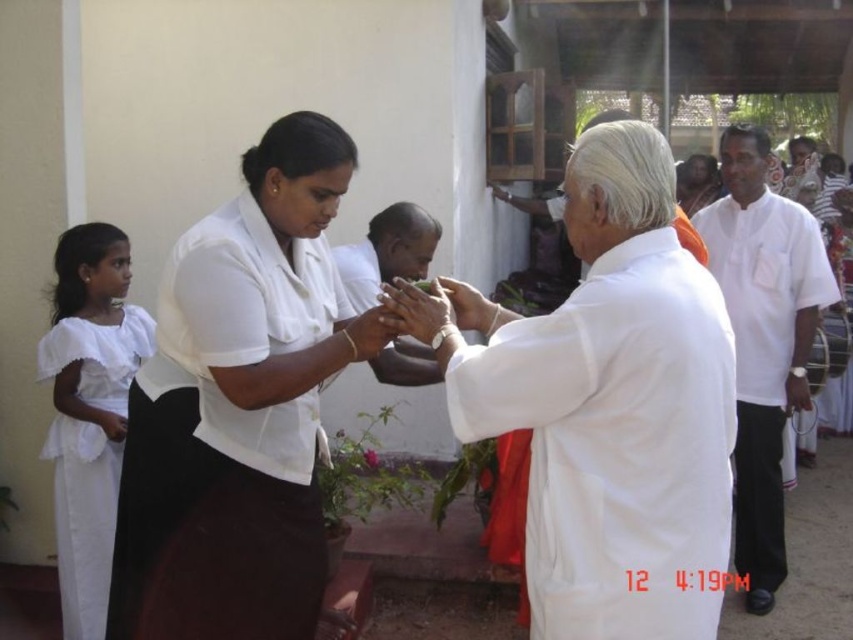
Consider the image. You are a photographer trying to capture a closeup shot of both the matte white hands at center and the white smooth hand at center. Given that your camera has a depth of field that can focus on objects within 3 inches of each other, will both hands be in focus?

The distance between the matte white hands at center and the white smooth hand at center is 3.47 inches. Since the depth of field can only focus on objects within 3 inches, the hands are slightly too far apart to both be in focus.

You are an observer at this event and notice the white cloth at center and the matte white hands at center. Based on their positions, which object is located to the right side?

The white cloth at center is located to the right of the matte white hands at center.